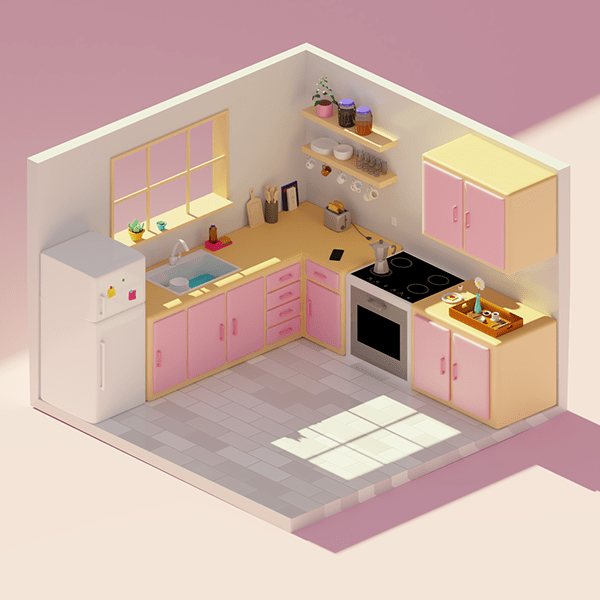
I want to click on white door handle on refrigerator, so click(x=103, y=366).